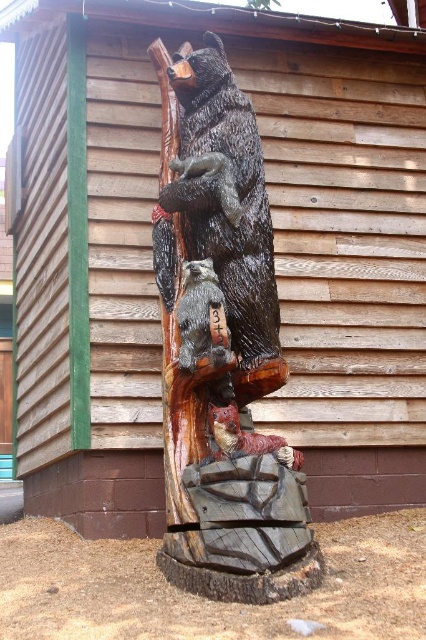
You are a delivery person trying to place a new sculpture in the same scene. The new sculpture is 12 inches wide. Can the space between the carved wood bear at center and the carved wood raccoon at center accommodate the new sculpture without moving either existing sculptures?

The space between the carved wood bear at center and the carved wood raccoon at center is 10.58 inches. Since the new sculpture is 12 inches wide, it cannot fit in the available space as it is wider than the gap between them.

You are standing in front of the wooden sculpture and want to touch both the carved wood bear at center and the carved wood raccoon at center. Which one can you reach first without moving your position?

The carved wood bear at center is closer to the viewer than the carved wood raccoon at center, so you can reach the carved wood bear at center first without moving your position.

You are an artist planning to place a new sculpture in front of the wooden building with green vertical trim. You have two options from the image, the carved wood bear at center and the carved wood raccoon at center. Which sculpture is wider so it can be the focal point?

The carved wood bear at center is wider than the carved wood raccoon at center, so it can be the focal point.